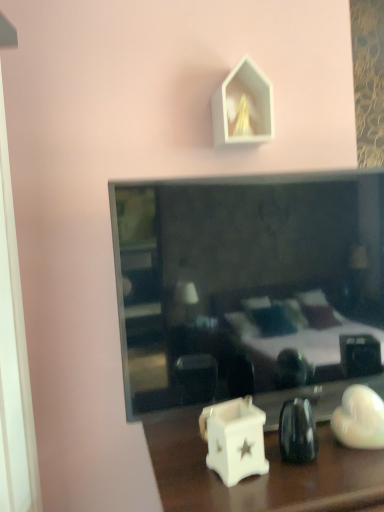
The height and width of the screenshot is (512, 384). I want to click on free location to the right of white ceramic candle holder at lower center, so click(x=324, y=472).